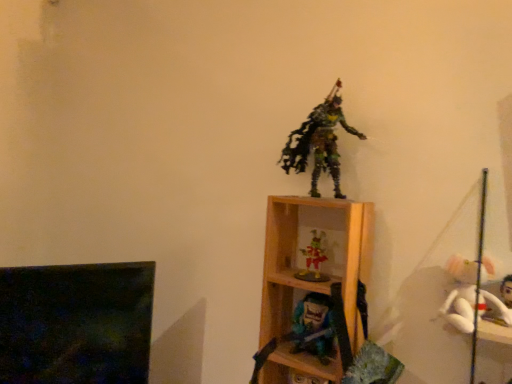
Question: Which direction should I rotate to look at matte blue plastic toy at center, which is the first toy in bottom-to-top order, — up or down?

Choices:
 (A) down
 (B) up

Answer: (A)

Question: Could you tell me if white plush at right, which is the third toy from top to bottom, is turned towards multicolored plastic figure at center, which is the 4th toy in bottom-to-top order?

Choices:
 (A) yes
 (B) no

Answer: (B)

Question: Is white plush at right, which is the third toy from top to bottom, not inside multicolored plastic figure at center, which is the 4th toy in bottom-to-top order?

Choices:
 (A) yes
 (B) no

Answer: (A)

Question: Considering the relative sizes of white plush at right, which is the second toy from bottom to top, and multicolored plastic figure at center, which is the first toy in top-to-bottom order, in the image provided, is white plush at right, which is the second toy from bottom to top, thinner than multicolored plastic figure at center, which is the first toy in top-to-bottom order,?

Choices:
 (A) yes
 (B) no

Answer: (A)

Question: From a real-world perspective, is white plush at right, which is the third toy from top to bottom, physically below multicolored plastic figure at center, which is the 4th toy in bottom-to-top order?

Choices:
 (A) no
 (B) yes

Answer: (B)

Question: Can you confirm if white plush at right, which is the second toy from bottom to top, is bigger than multicolored plastic figure at center, which is the 4th toy in bottom-to-top order?

Choices:
 (A) yes
 (B) no

Answer: (B)

Question: Is white plush at right, which is the third toy from top to bottom, at the left side of multicolored plastic figure at center, which is the first toy in top-to-bottom order?

Choices:
 (A) yes
 (B) no

Answer: (B)

Question: From the image's perspective, is multicolored plastic figure at center, which is the 4th toy in bottom-to-top order, located above shiny plastic figurine at center, the third toy from the bottom?

Choices:
 (A) yes
 (B) no

Answer: (A)

Question: Can you confirm if multicolored plastic figure at center, which is the first toy in top-to-bottom order, is shorter than shiny plastic figurine at center, the third toy from the bottom?

Choices:
 (A) no
 (B) yes

Answer: (A)

Question: Is multicolored plastic figure at center, which is the 4th toy in bottom-to-top order, closer to the viewer compared to shiny plastic figurine at center, the third toy from the bottom?

Choices:
 (A) yes
 (B) no

Answer: (A)

Question: Is multicolored plastic figure at center, which is the first toy in top-to-bottom order, to the right of shiny plastic figurine at center, the third toy from the bottom, from the viewer's perspective?

Choices:
 (A) no
 (B) yes

Answer: (B)

Question: Is multicolored plastic figure at center, which is the 4th toy in bottom-to-top order, completely or partially outside of shiny plastic figurine at center, the third toy from the bottom?

Choices:
 (A) yes
 (B) no

Answer: (A)

Question: Does multicolored plastic figure at center, which is the first toy in top-to-bottom order, come behind shiny plastic figurine at center, the third toy from the bottom?

Choices:
 (A) yes
 (B) no

Answer: (B)

Question: From the image's perspective, is matte blue plastic toy at center, which is the first toy in bottom-to-top order, located above white plush at right, which is the third toy from top to bottom?

Choices:
 (A) yes
 (B) no

Answer: (B)